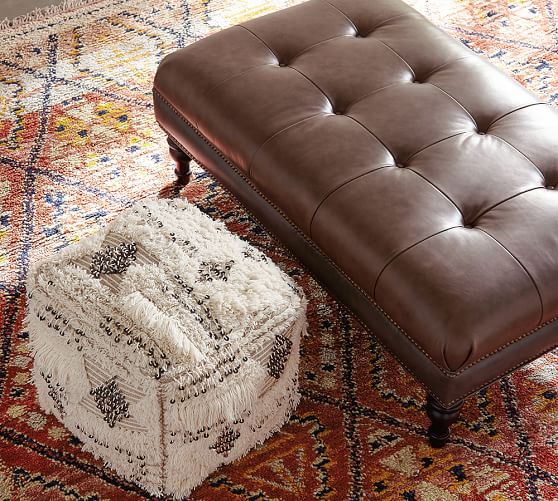
Identify the location of floor. The width and height of the screenshot is (558, 501). (9, 7).